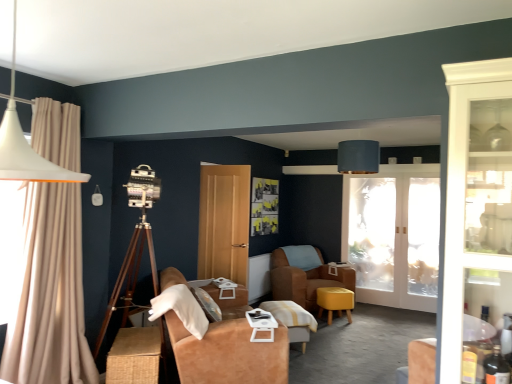
Question: Considering their positions, is wooden tripod at left located in front of or behind matte yellow stool at center?

Choices:
 (A) behind
 (B) front

Answer: (B)

Question: From a real-world perspective, is wooden tripod at left physically located above or below matte yellow stool at center?

Choices:
 (A) below
 (B) above

Answer: (B)

Question: Which of these objects is positioned closest to the white plastic tray at center, the 2th table when ordered from right to left?

Choices:
 (A) wooden table at center, placed as the 1th table when sorted from right to left
 (B) beige fabric curtain at left
 (C) woven brown table at lower left, which appears as the second table when viewed from the back
 (D) suede-like brown couch at center
 (E) matte yellow stool at center

Answer: (D)

Question: Which object is the farthest from the light brown wood door at center?

Choices:
 (A) matte blue fabric table lamp at upper center
 (B) beige fabric curtain at left
 (C) suede brown armchair at center
 (D) white plastic tray at center, the 1th table in the front-to-back sequence
 (E) suede-like brown couch at center

Answer: (B)